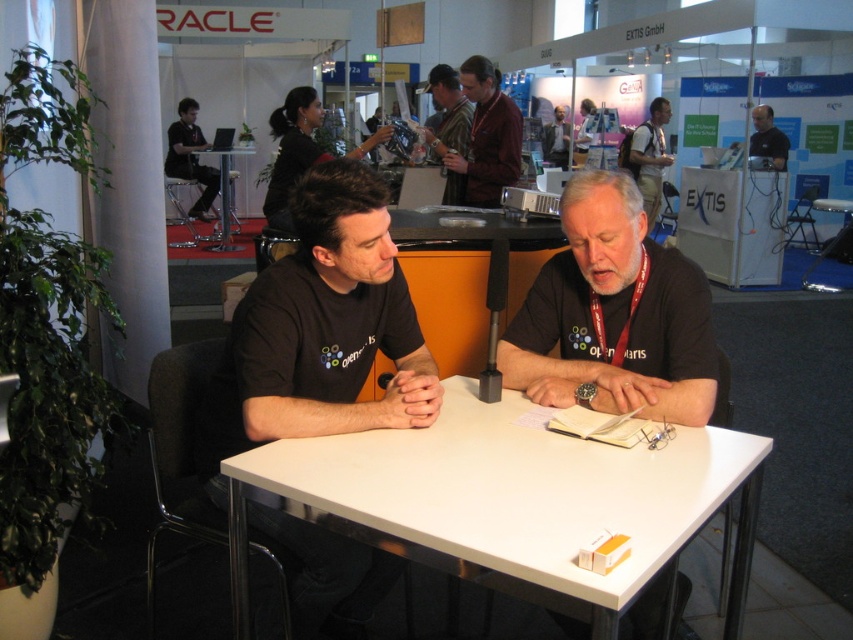
Is striped shirt at center thinner than dark brown leather backpack at upper right?

Correct, striped shirt at center's width is less than dark brown leather backpack at upper right's.

Identify the location of striped shirt at center. (447, 115).

Is black fabric shirt at center thinner than dark brown leather backpack at upper right?

Yes.

Can you confirm if black fabric shirt at center is bigger than dark brown leather backpack at upper right?

No, black fabric shirt at center is not bigger than dark brown leather backpack at upper right.

Between point (579, 316) and point (664, 147), which one is positioned behind?

The point (664, 147) is behind.

Where is `black fabric shirt at center`? This screenshot has height=640, width=853. black fabric shirt at center is located at coordinates (613, 316).

Consider the image. Who is positioned more to the left, black fabric shirt at center or white plastic table at center?

From the viewer's perspective, white plastic table at center appears more on the left side.

Does black fabric shirt at center appear on the left side of white plastic table at center?

Incorrect, black fabric shirt at center is not on the left side of white plastic table at center.

Find the location of a particular element. The height and width of the screenshot is (640, 853). black fabric shirt at center is located at coordinates (613, 316).

Identify the location of black fabric shirt at center. (613, 316).